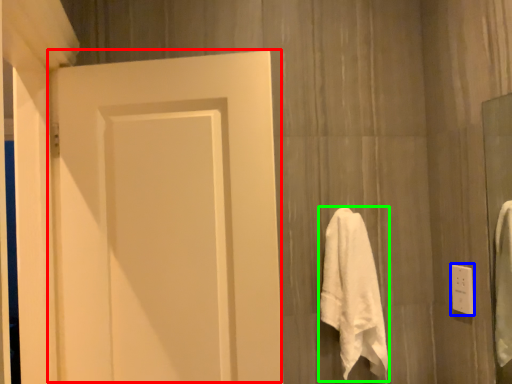
Question: Which object is the farthest from door (highlighted by a red box)? Choose among these: electric outlet (highlighted by a blue box) or towel (highlighted by a green box).

Choices:
 (A) electric outlet
 (B) towel

Answer: (A)